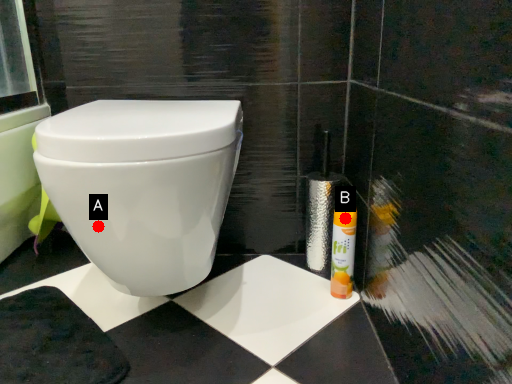
Question: Two points are circled on the image, labeled by A and B beside each circle. Which of the following is the closest to the observer?

Choices:
 (A) A is closer
 (B) B is closer

Answer: (A)